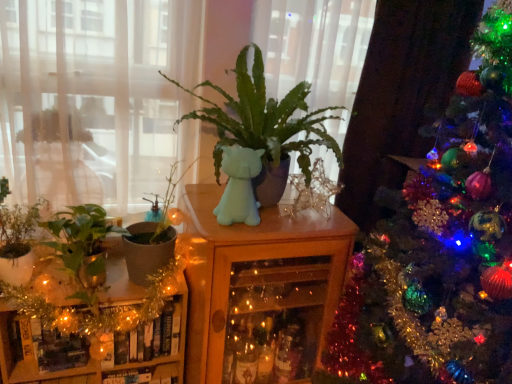
Question: Is green matte pot at left, marked as the third houseplant in a left-to-right arrangement, completely or partially outside of gold tinsel garland at lower left, the 1th furniture in the left-to-right sequence?

Choices:
 (A) yes
 (B) no

Answer: (A)

Question: Can you confirm if green matte pot at left, the second houseplant in the right-to-left sequence, is shorter than gold tinsel garland at lower left, the second furniture from the right?

Choices:
 (A) no
 (B) yes

Answer: (B)

Question: Are green matte pot at left, the second houseplant in the right-to-left sequence, and gold tinsel garland at lower left, the second furniture from the right, making contact?

Choices:
 (A) no
 (B) yes

Answer: (A)

Question: Can you confirm if green matte pot at left, marked as the third houseplant in a left-to-right arrangement, is bigger than gold tinsel garland at lower left, the 1th furniture in the left-to-right sequence?

Choices:
 (A) no
 (B) yes

Answer: (A)

Question: From the image's perspective, would you say green matte pot at left, marked as the third houseplant in a left-to-right arrangement, is shown under gold tinsel garland at lower left, the second furniture from the right?

Choices:
 (A) yes
 (B) no

Answer: (B)

Question: Does green matte pot at left, the second houseplant in the right-to-left sequence, have a smaller size compared to gold tinsel garland at lower left, the 1th furniture in the left-to-right sequence?

Choices:
 (A) no
 (B) yes

Answer: (B)

Question: Can you confirm if transparent glass window at upper left is positioned to the right of green matte plant at center, which is counted as the first houseplant, starting from the right?

Choices:
 (A) no
 (B) yes

Answer: (A)

Question: From a real-world perspective, does transparent glass window at upper left stand above green matte plant at center, which is counted as the first houseplant, starting from the right?

Choices:
 (A) no
 (B) yes

Answer: (A)

Question: Considering the relative sizes of transparent glass window at upper left and green matte plant at center, acting as the fourth houseplant starting from the left, in the image provided, is transparent glass window at upper left thinner than green matte plant at center, acting as the fourth houseplant starting from the left,?

Choices:
 (A) yes
 (B) no

Answer: (A)

Question: From the image's perspective, would you say transparent glass window at upper left is positioned over green matte plant at center, acting as the fourth houseplant starting from the left?

Choices:
 (A) no
 (B) yes

Answer: (B)

Question: Would you say transparent glass window at upper left contains green matte plant at center, acting as the fourth houseplant starting from the left?

Choices:
 (A) yes
 (B) no

Answer: (B)

Question: Is transparent glass window at upper left positioned behind green matte plant at center, which is counted as the first houseplant, starting from the right?

Choices:
 (A) yes
 (B) no

Answer: (A)

Question: Is transparent glass window at upper left positioned far away from green matte plant at left, the 4th houseplant positioned from the right?

Choices:
 (A) yes
 (B) no

Answer: (B)